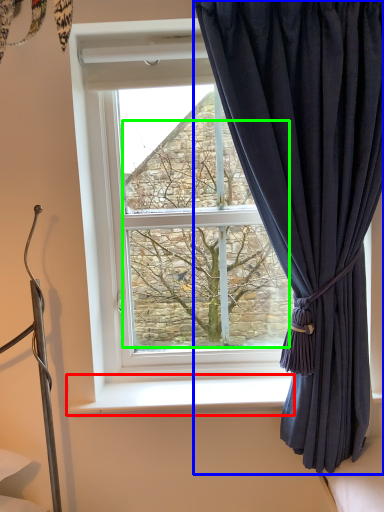
Question: Considering the real-world distances, which object is farthest from window sill (highlighted by a red box)? curtain (highlighted by a blue box) or tree (highlighted by a green box)?

Choices:
 (A) curtain
 (B) tree

Answer: (A)